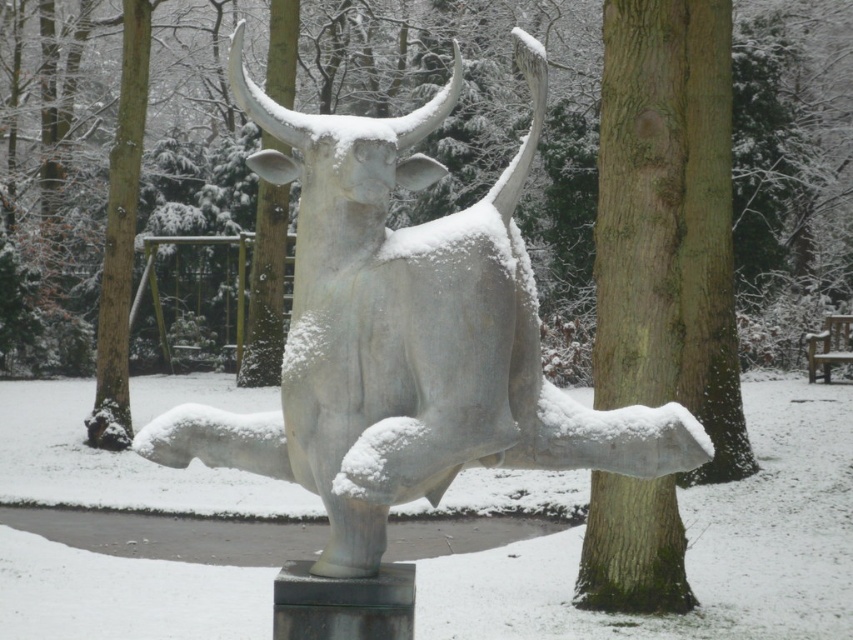
Question: Is white marble bull at center positioned at the back of smooth bark tree at center?

Choices:
 (A) yes
 (B) no

Answer: (B)

Question: Does white marble bull at center have a lesser width compared to smooth bark tree at center?

Choices:
 (A) no
 (B) yes

Answer: (B)

Question: Where is white marble bull at center located in relation to smooth bark tree at center in the image?

Choices:
 (A) above
 (B) below

Answer: (B)

Question: Which point is closer to the camera taking this photo?

Choices:
 (A) (473, 230)
 (B) (691, 0)

Answer: (A)

Question: Among these objects, which one is farthest from the camera?

Choices:
 (A) smooth bark tree at center
 (B) white marble bull at center

Answer: (A)